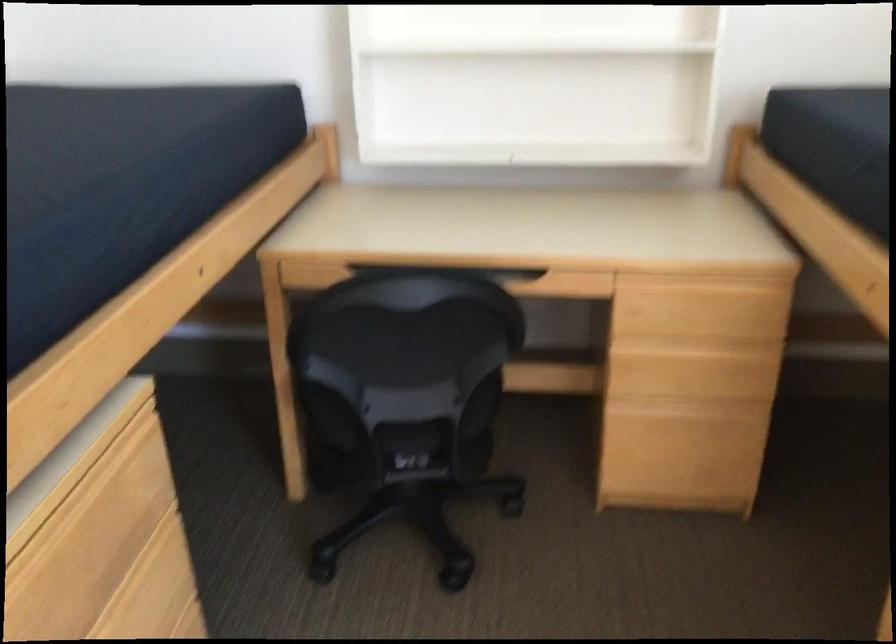
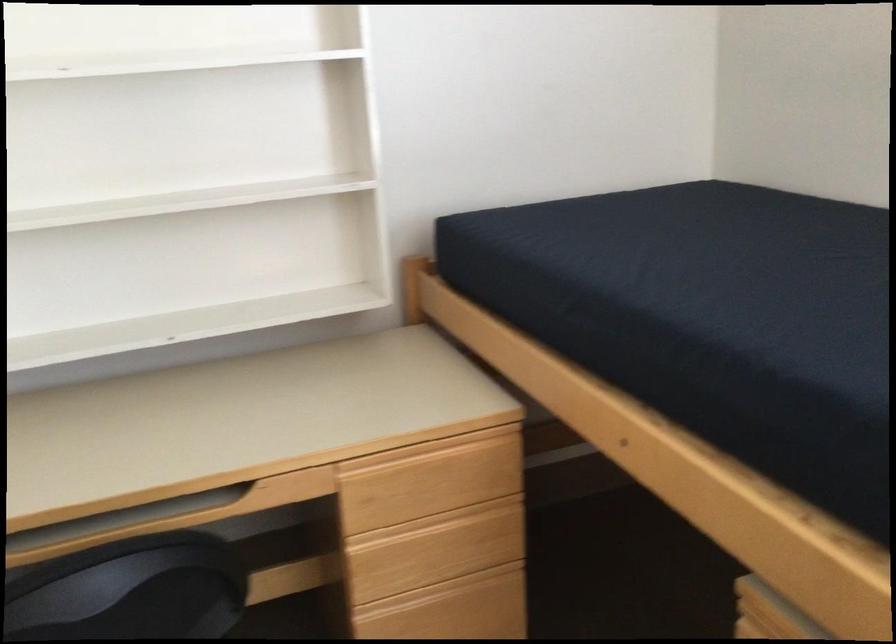
Question: In a continuous first-person perspective shot, in which direction is the camera moving?

Choices:
 (A) Left
 (B) Right
 (C) Forward
 (D) Backward

Answer: (C)